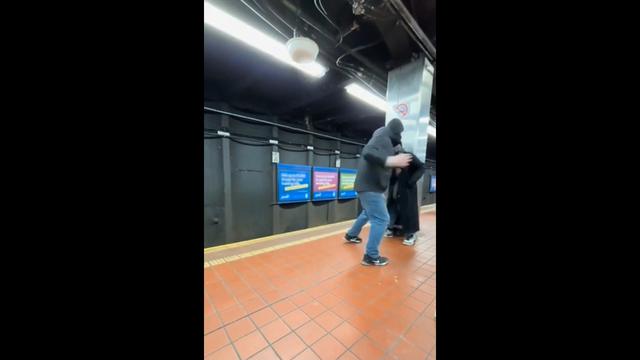
Identify the location of floor. The image size is (640, 360). (317, 309).